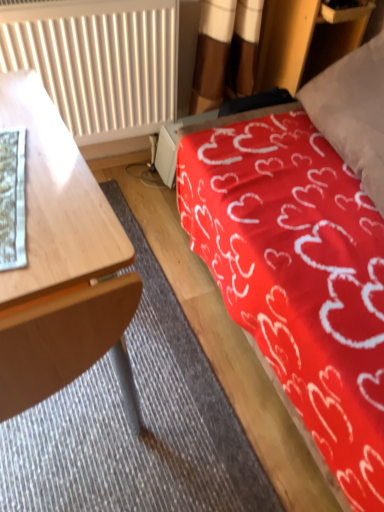
What are the coordinates of `vacant space underneath white textured radiator at upper left (from a real-world perspective)` in the screenshot? It's located at (118, 168).